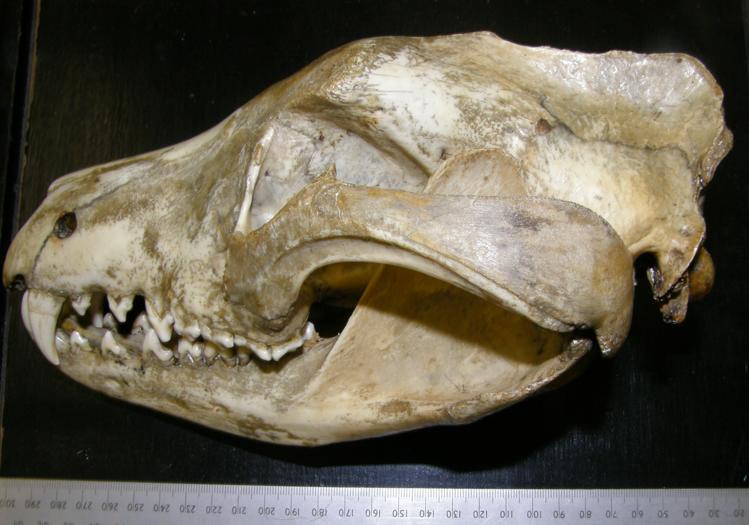
The width and height of the screenshot is (749, 525). I want to click on black table, so click(634, 429).